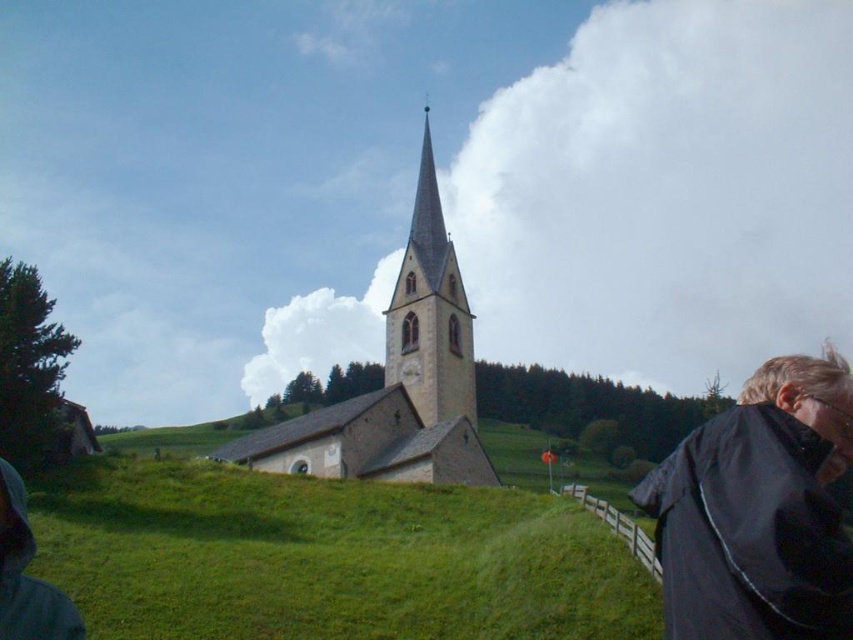
You are a landscape architect planning to install a new pathway between the church and the green grassy hillside at center. The pathway must be exactly 40 meters long. Will the pathway fit perfectly between them?

The distance between the church and the green grassy hillside at center is 40.32 meters, so a 40 meter pathway will be slightly shorter and not fit perfectly between them.

You are standing at the base of the green grassy hillside at center and want to walk towards the black matte jacket at lower right. Which direction should you head?

You should head to the right because the green grassy hillside at center is to the left of the black matte jacket at lower right.